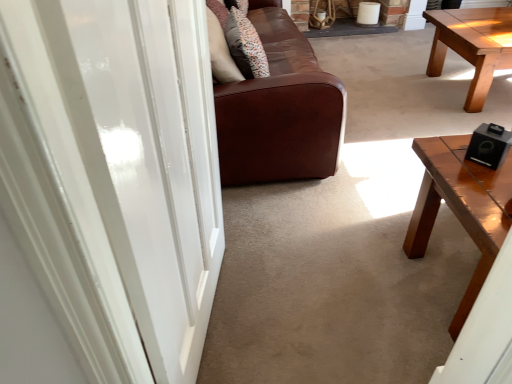
The height and width of the screenshot is (384, 512). What are the coordinates of `free point behind white glossy door at center` in the screenshot? It's located at (270, 237).